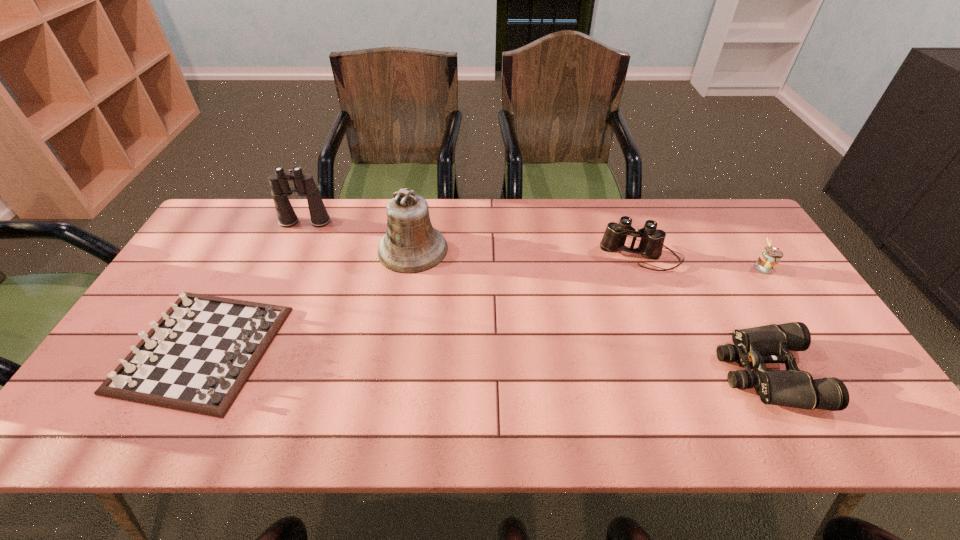
You are a GUI agent. You are given a task and a screenshot of the screen. Output one action in this format:
    pyautogui.click(x=<x>, y=<y>)
    Task: Click on the object present at the left edge
    This screenshot has height=540, width=960.
    Given the screenshot: What is the action you would take?
    pyautogui.click(x=197, y=358)

The height and width of the screenshot is (540, 960). What are the coordinates of `can that is at the right edge` in the screenshot? It's located at (769, 258).

The image size is (960, 540). I want to click on binoculars situated at the right edge, so click(x=753, y=347).

Where is `object that is at the near left corner`? object that is at the near left corner is located at coordinates (197, 358).

The width and height of the screenshot is (960, 540). What are the coordinates of `object present at the near right corner` in the screenshot? It's located at (753, 347).

Identify the location of vacant space at the far edge of the desktop. (319, 241).

In the image, there is a desktop. Find the location of `vacant space at the near edge`. vacant space at the near edge is located at coordinates (530, 430).

Where is `vacant space at the right edge of the desktop`? This screenshot has height=540, width=960. vacant space at the right edge of the desktop is located at coordinates (810, 366).

Find the location of a particular element. Image resolution: width=960 pixels, height=540 pixels. vacant space at the far left corner of the desktop is located at coordinates (257, 230).

Locate an element on the screen. free spot at the near left corner of the desktop is located at coordinates (132, 418).